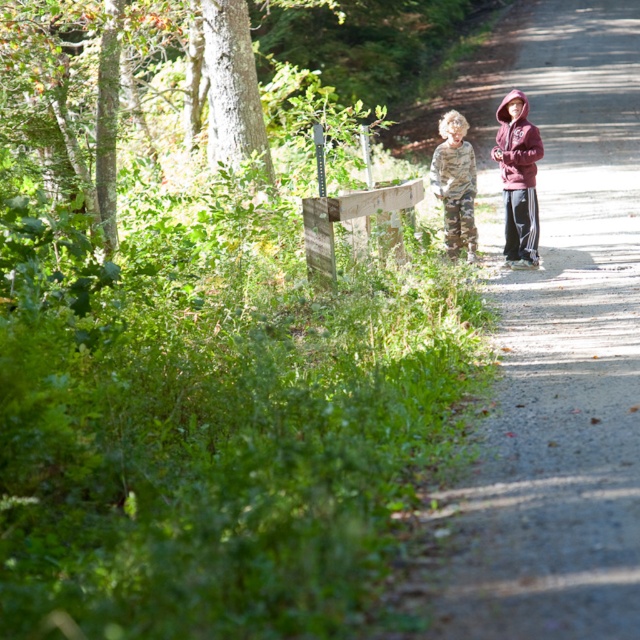
Where is `weathered wooden post at center`? This screenshot has width=640, height=640. weathered wooden post at center is located at coordinates (346, 218).

Is weathered wooden post at center above camo fabric jacket at center?

Actually, weathered wooden post at center is below camo fabric jacket at center.

Who is more distant from viewer, (x=365, y=196) or (x=442, y=150)?

The point (x=442, y=150) is more distant.

The width and height of the screenshot is (640, 640). Find the location of `weathered wooden post at center`. weathered wooden post at center is located at coordinates (346, 218).

Is camouflage pants at center below maroon fleece jacket at right?

Yes.

Does camouflage pants at center lie in front of maroon fleece jacket at right?

That is False.

Which is behind, point (468, 150) or point (512, 141)?

The point (468, 150) is behind.

Find the location of a particular element. Image resolution: width=640 pixels, height=640 pixels. camouflage pants at center is located at coordinates (456, 184).

Does camouflage pants at center appear over weathered wooden post at center?

Yes.

Who is lower down, camouflage pants at center or weathered wooden post at center?

weathered wooden post at center is below.

Find the location of a particular element. The height and width of the screenshot is (640, 640). camouflage pants at center is located at coordinates (456, 184).

This screenshot has height=640, width=640. In order to click on camouflage pants at center in this screenshot , I will do `click(456, 184)`.